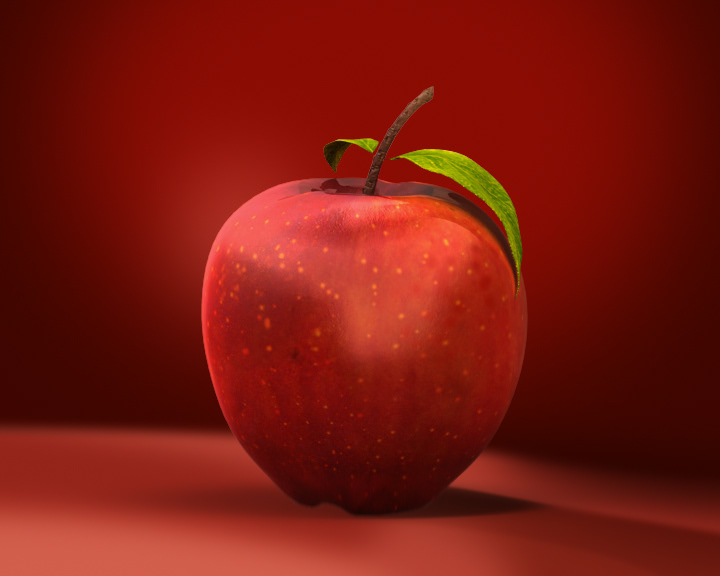
The width and height of the screenshot is (720, 576). In order to click on dark red wall in this screenshot , I will do `click(204, 86)`.